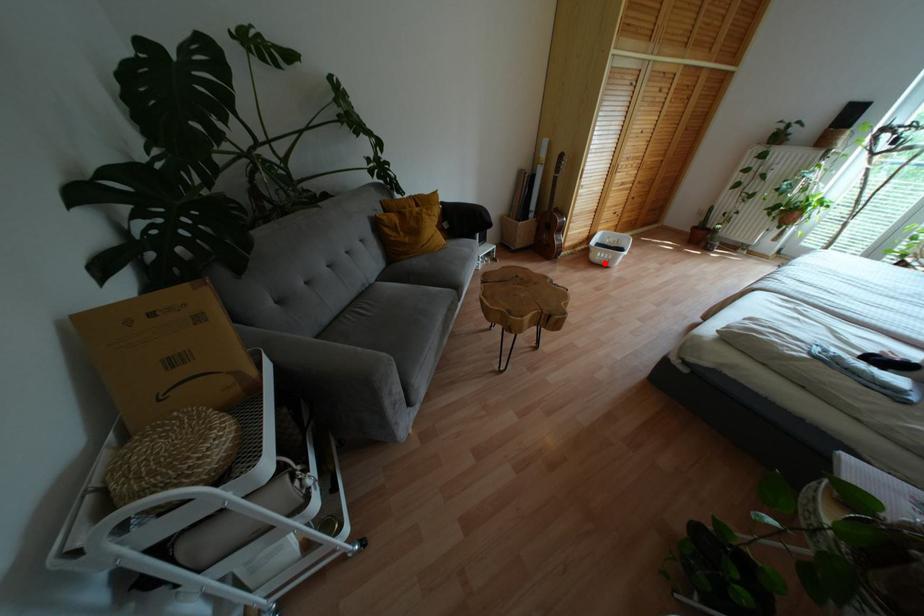
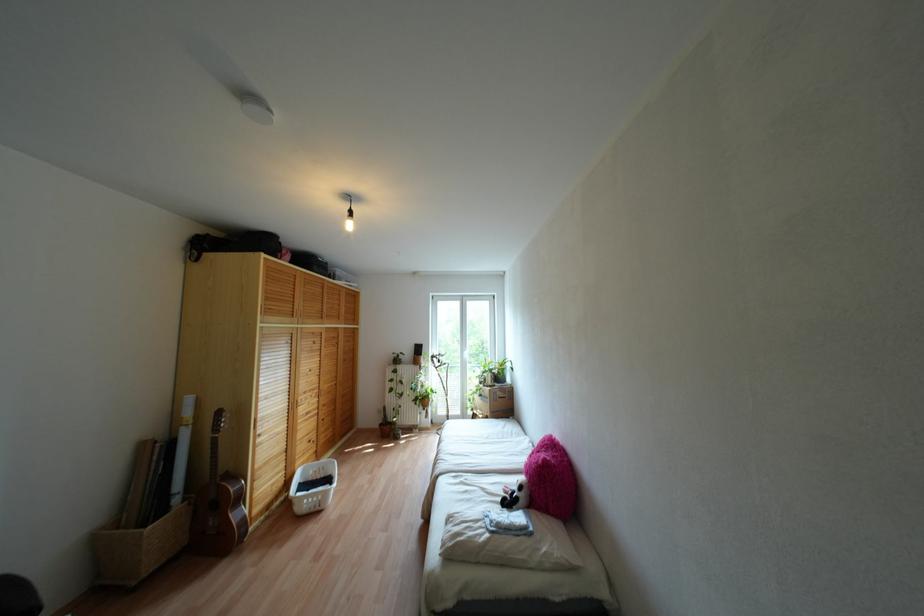
Question: I am providing you with two images of the same scene from different viewpoints. Given a red point in image1, look at the same physical point in image2. Is it:

Choices:
 (A) Closer to the viewpoint
 (B) Farther from the viewpoint

Answer: (B)